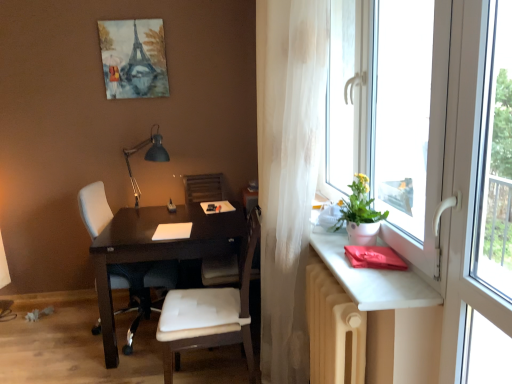
Where is `vacant space situated on the left part of white leather chair at center, marked as the first chair in a back-to-front arrangement`? The width and height of the screenshot is (512, 384). vacant space situated on the left part of white leather chair at center, marked as the first chair in a back-to-front arrangement is located at coordinates (52, 335).